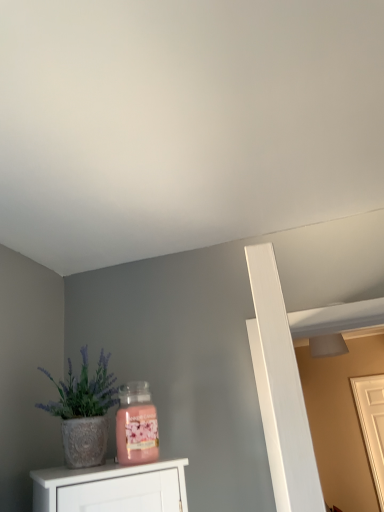
Question: From the image's perspective, is textured white pot at left above or below white wooden door at right?

Choices:
 (A) above
 (B) below

Answer: (A)

Question: In terms of height, does textured white pot at left look taller or shorter compared to white wooden door at right?

Choices:
 (A) tall
 (B) short

Answer: (B)

Question: From a real-world perspective, is textured white pot at left positioned above or below white wooden door at right?

Choices:
 (A) below
 (B) above

Answer: (B)

Question: Looking at their shapes, would you say white wooden door at right is wider or thinner than textured white pot at left?

Choices:
 (A) wide
 (B) thin

Answer: (B)

Question: Considering the positions of white wooden door at right and textured white pot at left in the image, is white wooden door at right taller or shorter than textured white pot at left?

Choices:
 (A) short
 (B) tall

Answer: (B)

Question: Considering their positions, is white wooden door at right located in front of or behind textured white pot at left?

Choices:
 (A) front
 (B) behind

Answer: (B)

Question: Is white wooden door at right bigger or smaller than textured white pot at left?

Choices:
 (A) big
 (B) small

Answer: (A)